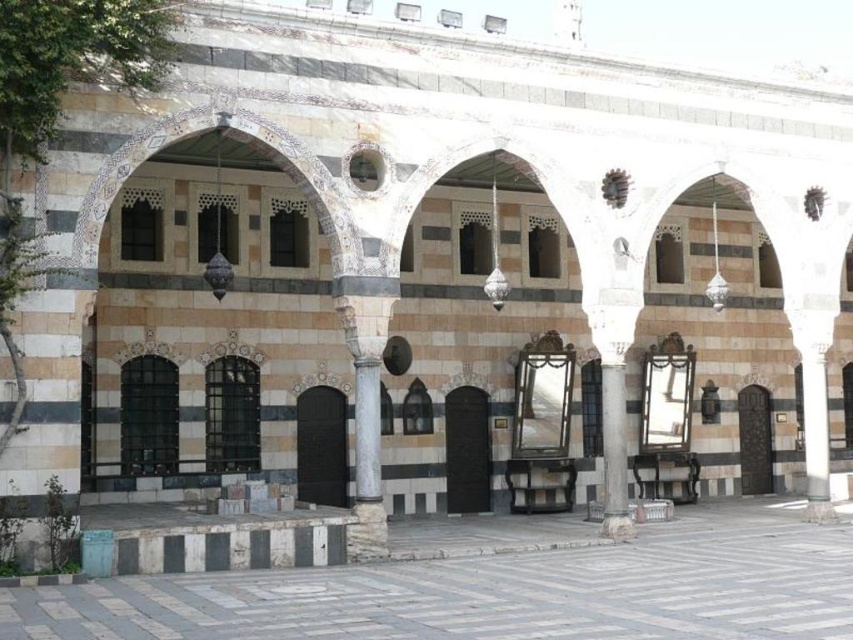
You are standing in the historical building and want to determine which of the two points, point (827, 556) or point (605, 372), is nearer to you. Based on the architectural layout described, which point is closer?

Point (827, 556) is closer to the viewer than point (605, 372).

You are an architect designing a new Islamic architectural project. You want to ensure that the marble tiles at center and the smooth gray column at center are proportionate. Which object should be placed higher to maintain the traditional aesthetic?

The smooth gray column at center should be placed higher than the marble tiles at center to maintain the traditional aesthetic, as the marble tiles at center is shorter than the smooth gray column at center.